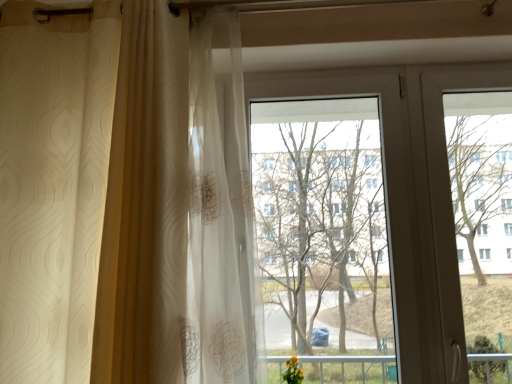
Question: From their relative heights in the image, would you say transparent glass window at center is taller or shorter than white sheer curtain at left?

Choices:
 (A) short
 (B) tall

Answer: (A)

Question: Considering the positions of transparent glass window at center and white sheer curtain at left in the image, is transparent glass window at center bigger or smaller than white sheer curtain at left?

Choices:
 (A) small
 (B) big

Answer: (A)

Question: Estimate the real-world distances between objects in this image. Which object is closer to the transparent plastic screen door at right?

Choices:
 (A) transparent glass window at center
 (B) white sheer curtain at left

Answer: (A)

Question: Considering the real-world distances, which object is closest to the white sheer curtain at left?

Choices:
 (A) transparent plastic screen door at right
 (B) transparent glass window at center

Answer: (B)